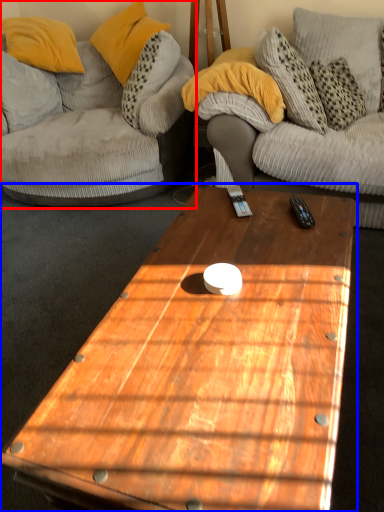
Question: Which of the following is the closest to the observer, studio couch (highlighted by a red box) or coffee table (highlighted by a blue box)?

Choices:
 (A) studio couch
 (B) coffee table

Answer: (B)